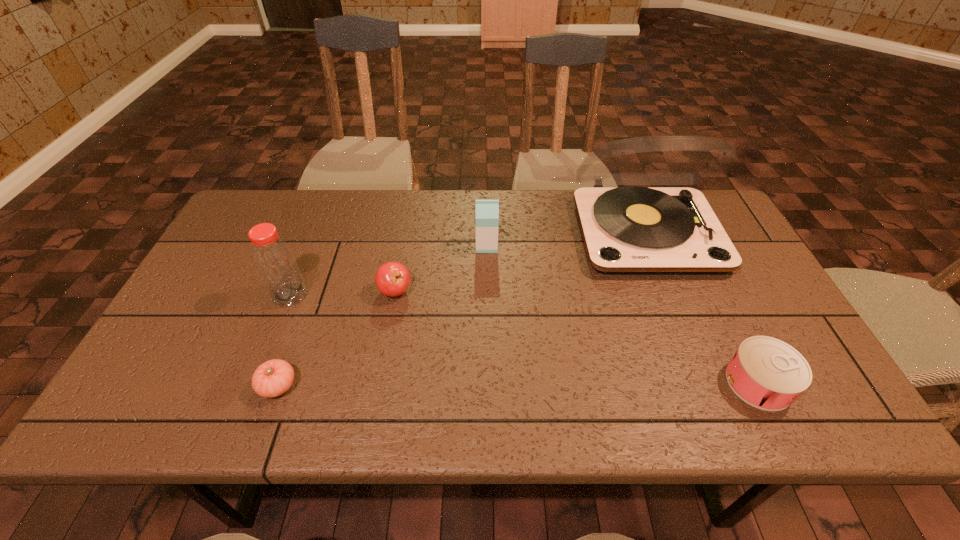
Find the location of a particular element. The height and width of the screenshot is (540, 960). the tallest object is located at coordinates (627, 230).

Image resolution: width=960 pixels, height=540 pixels. I want to click on bottle, so click(276, 264).

This screenshot has width=960, height=540. What are the coordinates of `the fourth object from left to right` in the screenshot? It's located at (487, 211).

Identify the location of the fourth shortest object. The height and width of the screenshot is (540, 960). (487, 211).

Where is `the third object from left to right`? The height and width of the screenshot is (540, 960). the third object from left to right is located at coordinates (392, 279).

Find the location of a particular element. can is located at coordinates (769, 374).

Identify the location of tomato. (274, 377).

The image size is (960, 540). In order to click on vacant area situated with the tonearm facing the front of the tallest object in this screenshot , I will do `click(671, 296)`.

Where is `free location located on the front of the second tallest object`? free location located on the front of the second tallest object is located at coordinates (251, 393).

This screenshot has width=960, height=540. I want to click on vacant area situated on the left of the fourth shortest object, so click(373, 246).